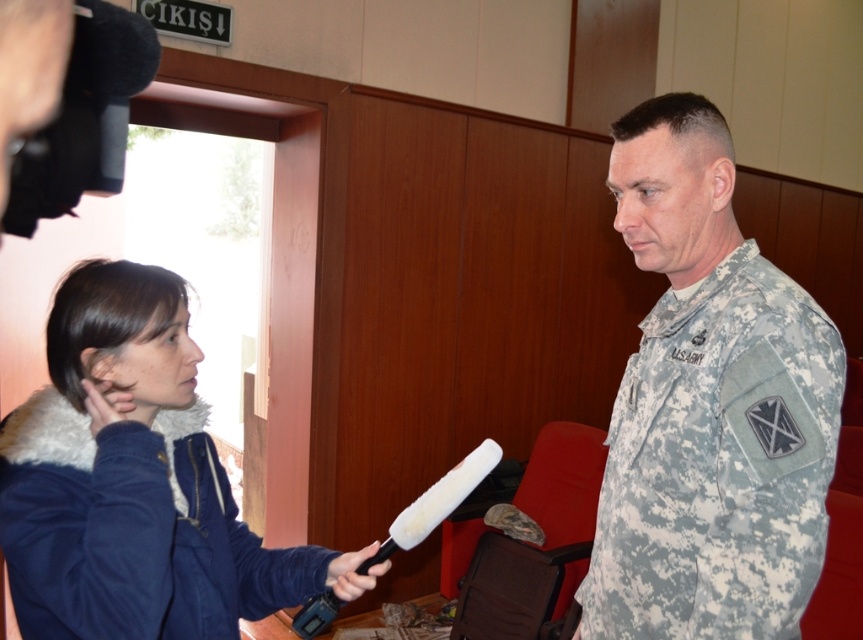
You are a photographer setting up for an interview photo shoot. You need to ensure that both the camouflage fabric uniform at center and the black rubber microphone at center are clearly visible in the frame. Given their sizes, which object should you focus on first to ensure proper framing?

The camouflage fabric uniform at center is much taller than the black rubber microphone at center, so you should focus on framing the camouflage fabric uniform at center first to ensure it fits well within the shot before adjusting for the smaller microphone.

You are a photographer adjusting your camera to focus on two specific points in the image. The first point is at coordinates point (20, 477) and the second is at point (331, 580). Which point should you focus on first if you want to capture both points clearly in the photo?

Point (20, 477) is closer to the camera than point (331, 580). Therefore, you should focus on point (20, 477) first to ensure both points are in clear focus.